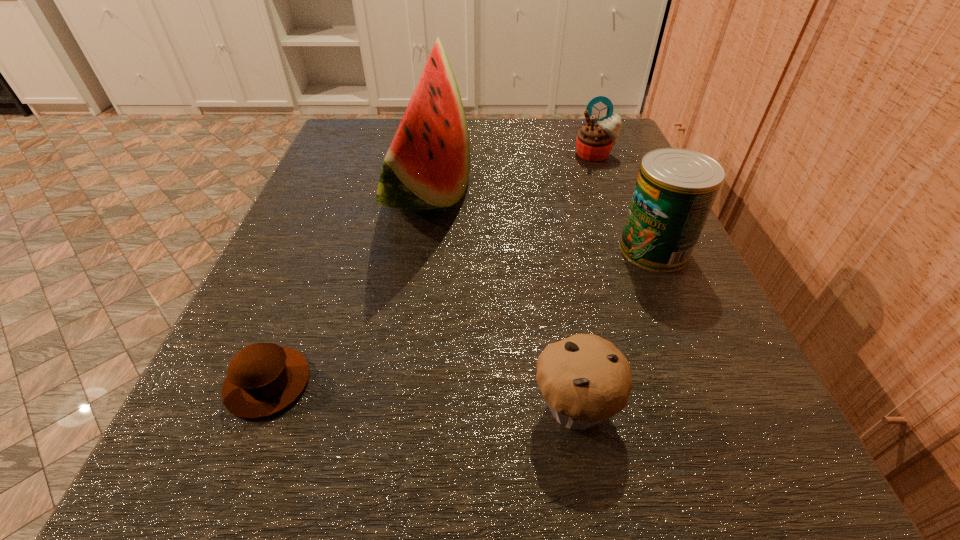
The width and height of the screenshot is (960, 540). Find the location of `watermelon`. watermelon is located at coordinates (427, 166).

The width and height of the screenshot is (960, 540). Identify the location of the tallest object. coord(427,166).

Locate an element on the screen. the fourth shortest object is located at coordinates (675, 190).

Identify the location of the third shortest object. (594, 142).

Where is `the rightmost muffin`? This screenshot has width=960, height=540. the rightmost muffin is located at coordinates (594, 142).

This screenshot has width=960, height=540. Identify the location of the second shortest object. (585, 379).

This screenshot has height=540, width=960. I want to click on the third object from right to left, so click(585, 379).

The height and width of the screenshot is (540, 960). What are the coordinates of `the leftmost object` in the screenshot? It's located at (263, 379).

Where is `the shortest muffin`? the shortest muffin is located at coordinates (263, 379).

The image size is (960, 540). What are the coordinates of `vacant position located 0.300m on the outer rind of the fourth object from right to left` in the screenshot? It's located at (642, 191).